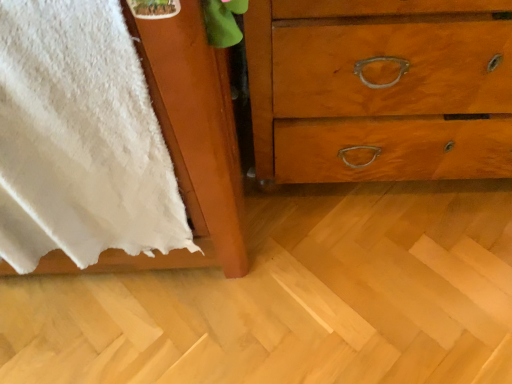
Locate an element on the screen. This screenshot has width=512, height=384. free spot below white soft fabric at left (from a real-world perspective) is located at coordinates (122, 288).